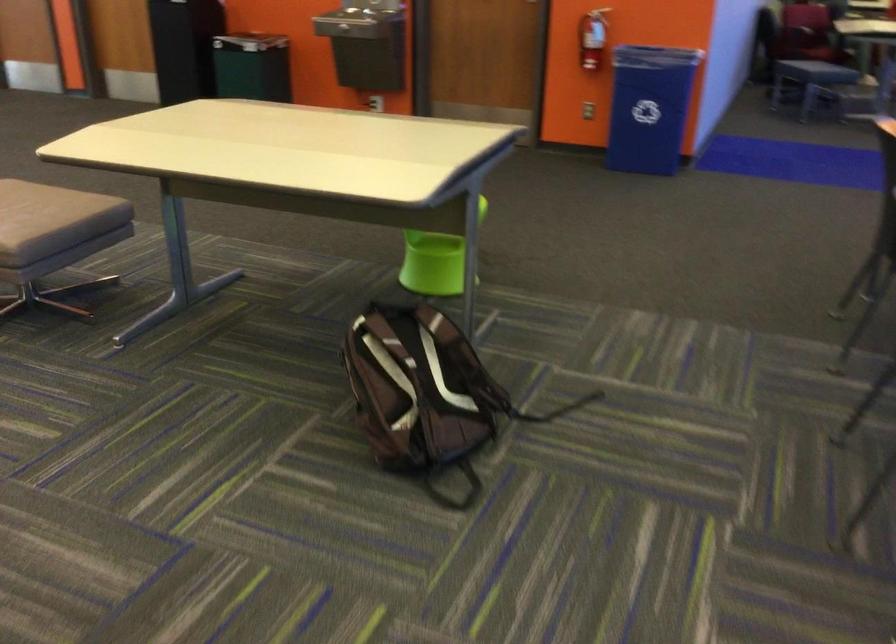
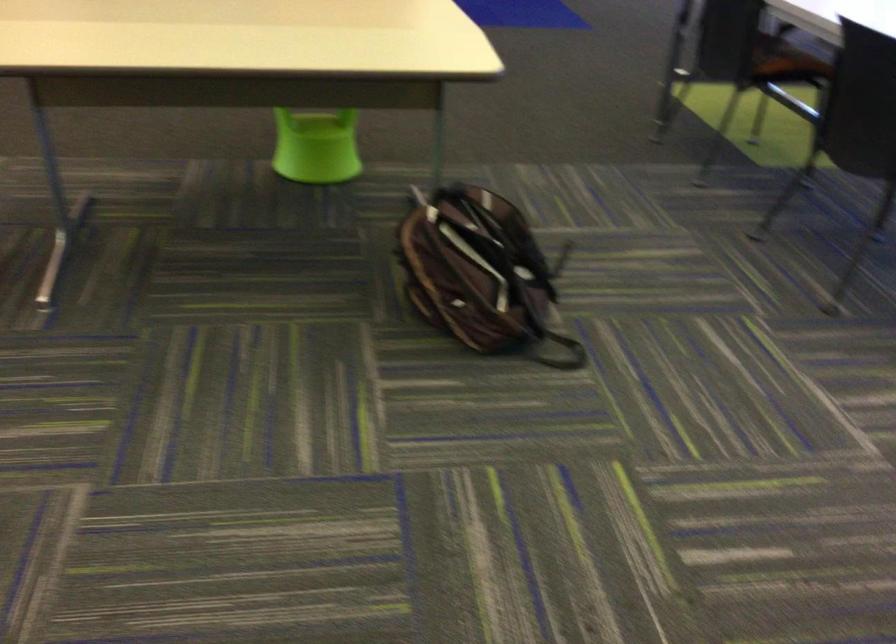
The point at (x=488, y=462) is marked in the first image. Where is the corresponding point in the second image?

(552, 322)